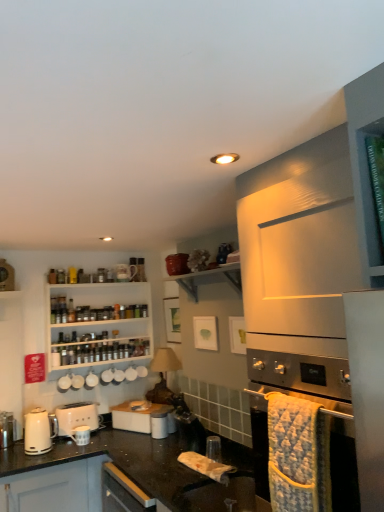
Question: Looking at their shapes, would you say stainless steel oven at lower right is wider or thinner than white glossy toaster at center?

Choices:
 (A) wide
 (B) thin

Answer: (A)

Question: Is stainless steel oven at lower right inside or outside of white glossy toaster at center?

Choices:
 (A) outside
 (B) inside

Answer: (A)

Question: Which of these objects is positioned farthest from the white glossy toaster at center?

Choices:
 (A) white wooden shelves at upper left
 (B) black granite countertop at lower center
 (C) white matte toaster at lower left, which is the 1th kitchen appliance from back to front
 (D) white glossy electric kettle at lower left, placed as the 1th kitchen appliance when sorted from front to back
 (E) white glossy shelf at upper center

Answer: (E)

Question: Considering the real-world distances, which object is closest to the black granite countertop at lower center?

Choices:
 (A) white wooden shelves at upper left
 (B) white glossy shelf at upper center
 (C) stainless steel oven at lower right
 (D) white glossy electric kettle at lower left, arranged as the 2th kitchen appliance when viewed from the back
 (E) white glossy toaster at center

Answer: (D)